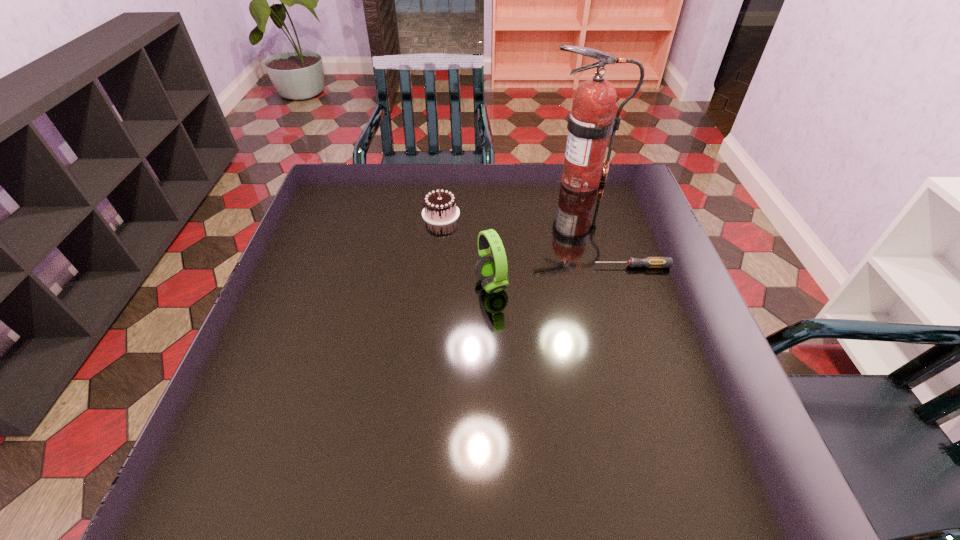
The width and height of the screenshot is (960, 540). In the image, there is a desktop. Identify the location of free region at the far edge. (411, 184).

In the image, there is a desktop. At what (x,y) coordinates should I click in order to perform the action: click on blank space at the left edge. Please return your answer as a coordinate pair (x, y). The width and height of the screenshot is (960, 540). Looking at the image, I should click on (268, 336).

At what (x,y) coordinates should I click in order to perform the action: click on vacant space at the right edge. Please return your answer as a coordinate pair (x, y). Looking at the image, I should click on (741, 423).

Locate an element on the screen. vacant region at the far left corner of the desktop is located at coordinates (372, 168).

Locate an element on the screen. The image size is (960, 540). vacant space at the far right corner of the desktop is located at coordinates (597, 193).

You are a GUI agent. You are given a task and a screenshot of the screen. Output one action in this format:
    pyautogui.click(x=<x>, y=<y>)
    Task: Click on the vacant area between the screwdriver and the headset
    Image resolution: width=960 pixels, height=540 pixels.
    Given the screenshot: What is the action you would take?
    pyautogui.click(x=562, y=275)

Find the location of `free spot between the farthest object and the screwdriver`. free spot between the farthest object and the screwdriver is located at coordinates (606, 224).

Find the location of a particular element. The width and height of the screenshot is (960, 540). free point between the chocolate cake and the fire extinguisher is located at coordinates (511, 198).

Locate an element on the screen. free space between the leftmost object and the headset is located at coordinates (467, 249).

Where is `vacant region between the headset and the shortest object`? vacant region between the headset and the shortest object is located at coordinates (562, 275).